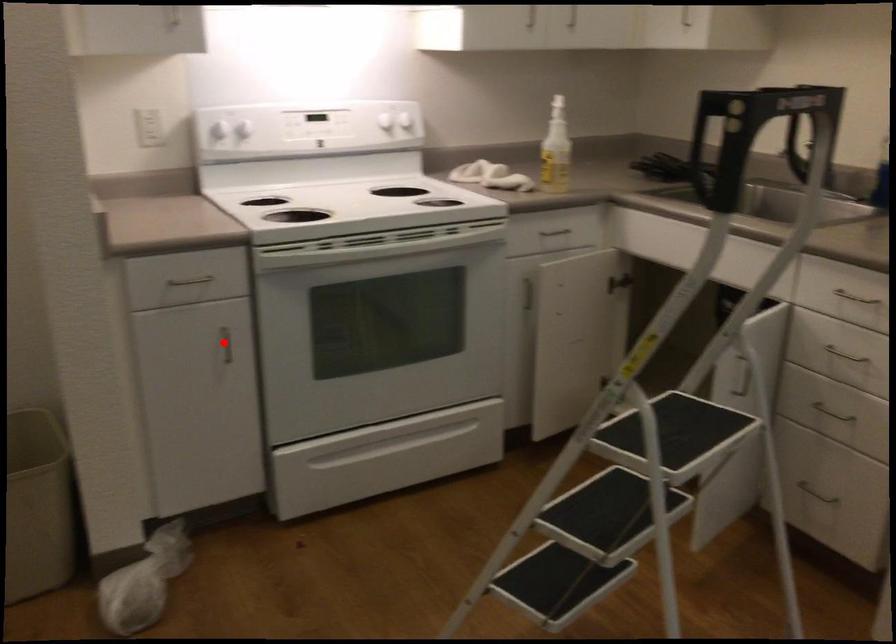
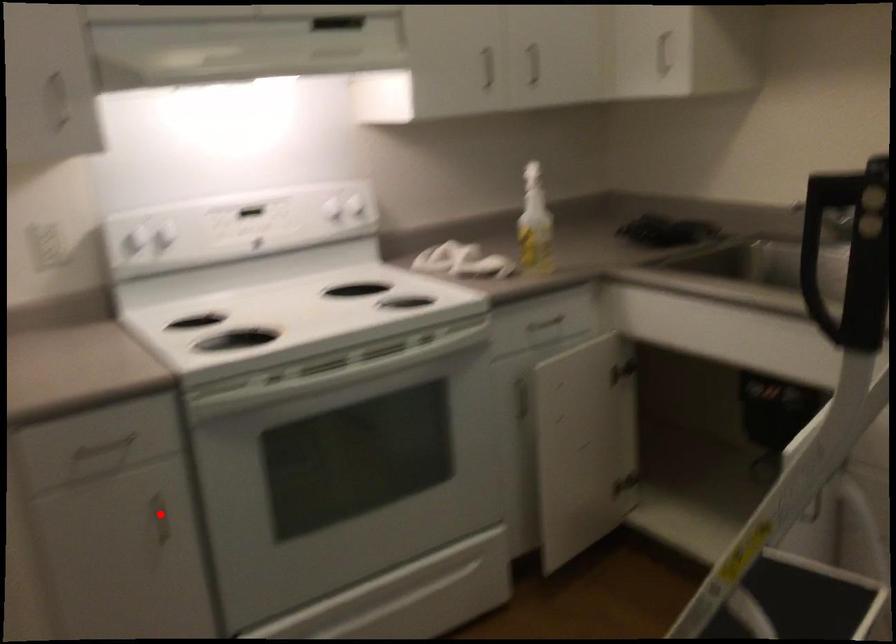
I am providing you with two images of the same scene from different viewpoints. A red point is marked on the first image and another point is marked on the second image. Do the highlighted points in image1 and image2 indicate the same real-world spot?

Yes